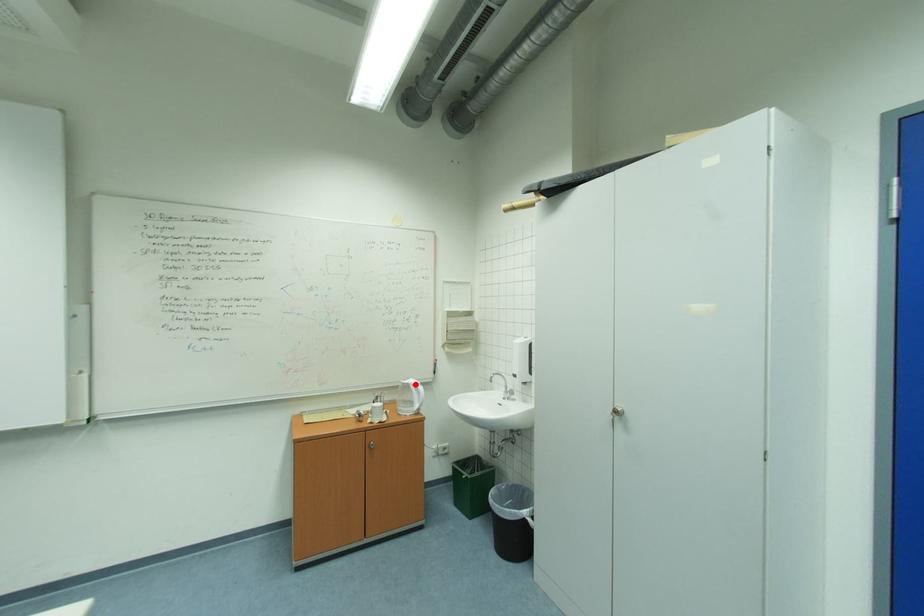
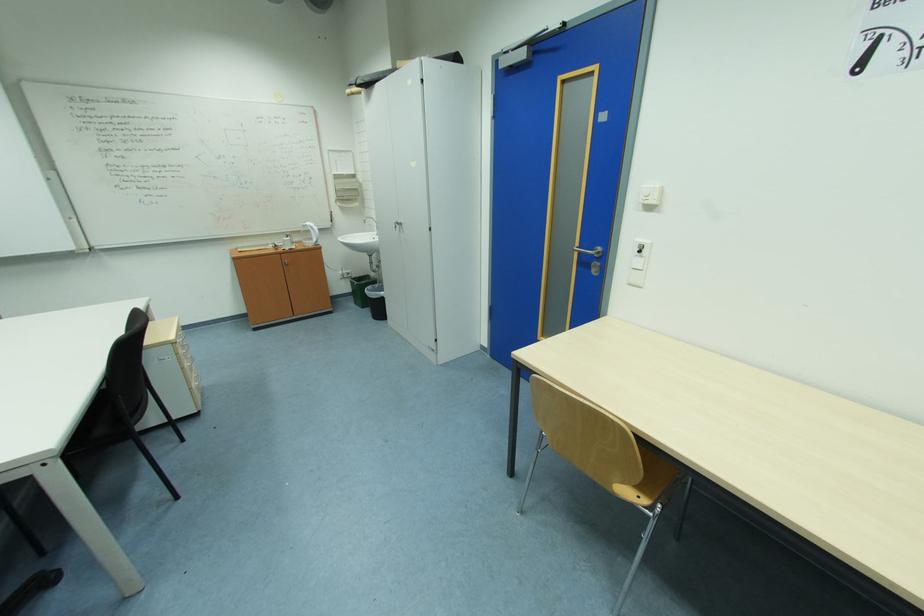
Question: I am providing you with two images of the same scene from different viewpoints. In image1, a red point is highlighted. Considering the same 3D point in image2, which of the following is correct?

Choices:
 (A) It is closer
 (B) It is farther

Answer: (A)